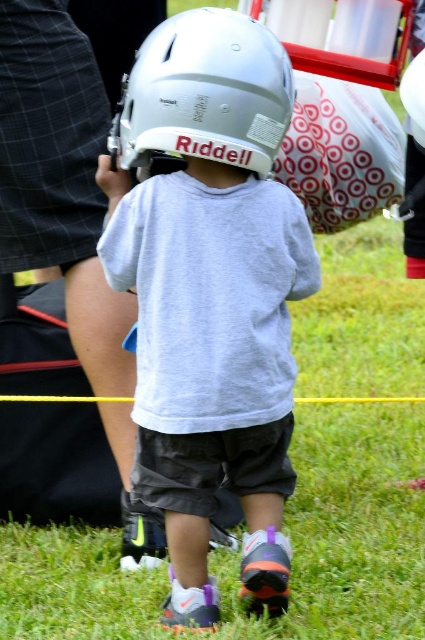
Can you confirm if matte gray helmet at center is wider than white matte football helmet at center?

Yes.

Who is higher up, matte gray helmet at center or white matte football helmet at center?

Positioned higher is white matte football helmet at center.

Is point (240, 451) positioned before point (201, 147)?

No, it is behind (201, 147).

Locate an element on the screen. This screenshot has height=640, width=425. matte gray helmet at center is located at coordinates (210, 292).